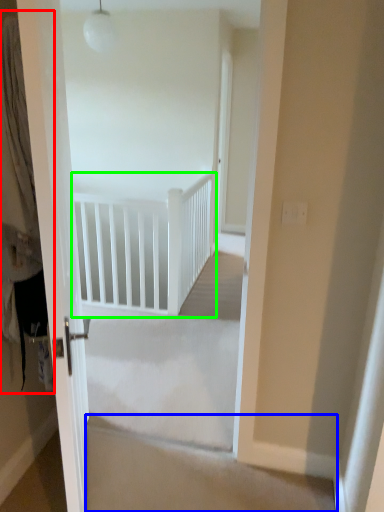
Question: Based on their relative distances, which object is nearer to curtain (highlighted by a red box)? Choose from stairwell (highlighted by a blue box) and rail (highlighted by a green box).

Choices:
 (A) stairwell
 (B) rail

Answer: (A)